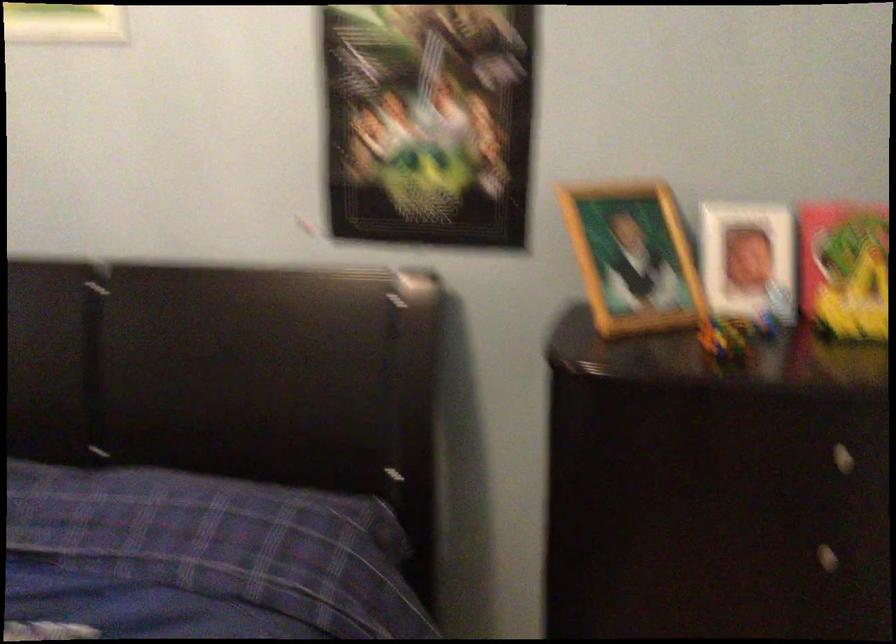
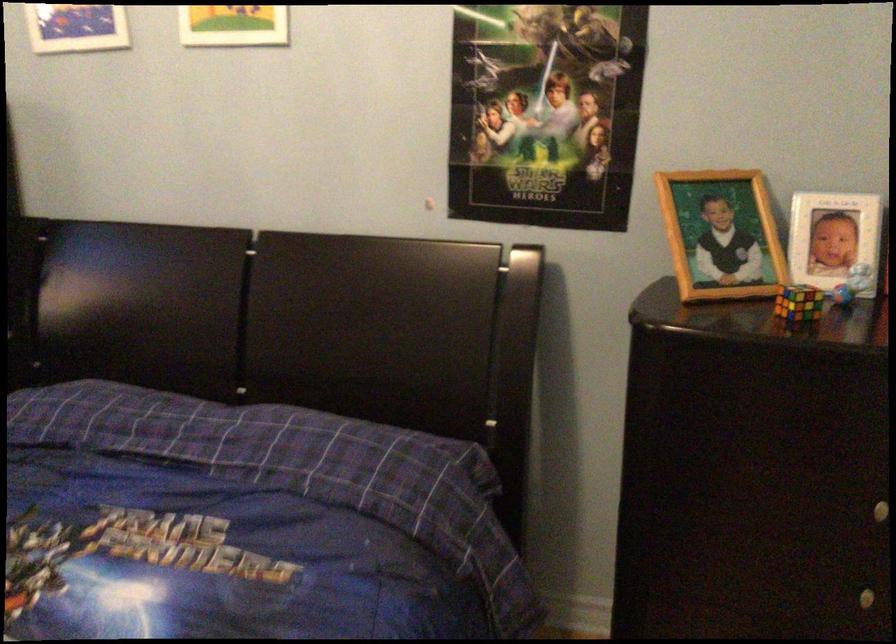
Where in the second image is the point corresponding to point (768, 299) from the first image?

(851, 283)